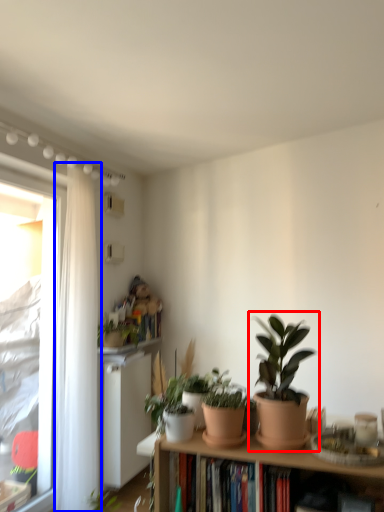
Question: Which object appears farthest to the camera in this image, houseplant (highlighted by a red box) or curtain (highlighted by a blue box)?

Choices:
 (A) houseplant
 (B) curtain

Answer: (B)